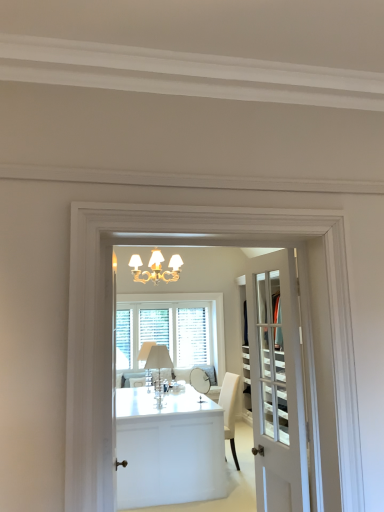
Question: From a real-world perspective, is white wood window at center on white glass lampshade at center?

Choices:
 (A) no
 (B) yes

Answer: (B)

Question: Is white wood window at center aimed at white glass lampshade at center?

Choices:
 (A) no
 (B) yes

Answer: (B)

Question: Is white wood window at center looking in the opposite direction of white glass lampshade at center?

Choices:
 (A) no
 (B) yes

Answer: (A)

Question: Does white wood window at center have a greater width compared to white glass lampshade at center?

Choices:
 (A) yes
 (B) no

Answer: (B)

Question: Can you confirm if white wood window at center is shorter than white glass lampshade at center?

Choices:
 (A) yes
 (B) no

Answer: (B)

Question: From a real-world perspective, is white wood window at center beneath white glass lampshade at center?

Choices:
 (A) yes
 (B) no

Answer: (B)

Question: Does white glossy cabinet at center appear on the right side of white glass door at center?

Choices:
 (A) no
 (B) yes

Answer: (A)

Question: Is white glossy cabinet at center at the left side of white glass door at center?

Choices:
 (A) no
 (B) yes

Answer: (B)

Question: Is white glossy cabinet at center turned away from white glass door at center?

Choices:
 (A) no
 (B) yes

Answer: (A)

Question: From the image's perspective, is white glossy cabinet at center below white glass door at center?

Choices:
 (A) no
 (B) yes

Answer: (B)

Question: Is white glossy cabinet at center not near white glass door at center?

Choices:
 (A) no
 (B) yes

Answer: (B)

Question: Is white glossy cabinet at center bigger than white glass door at center?

Choices:
 (A) yes
 (B) no

Answer: (A)

Question: From a real-world perspective, is white glass door at center located higher than white glossy cabinet at center?

Choices:
 (A) yes
 (B) no

Answer: (A)